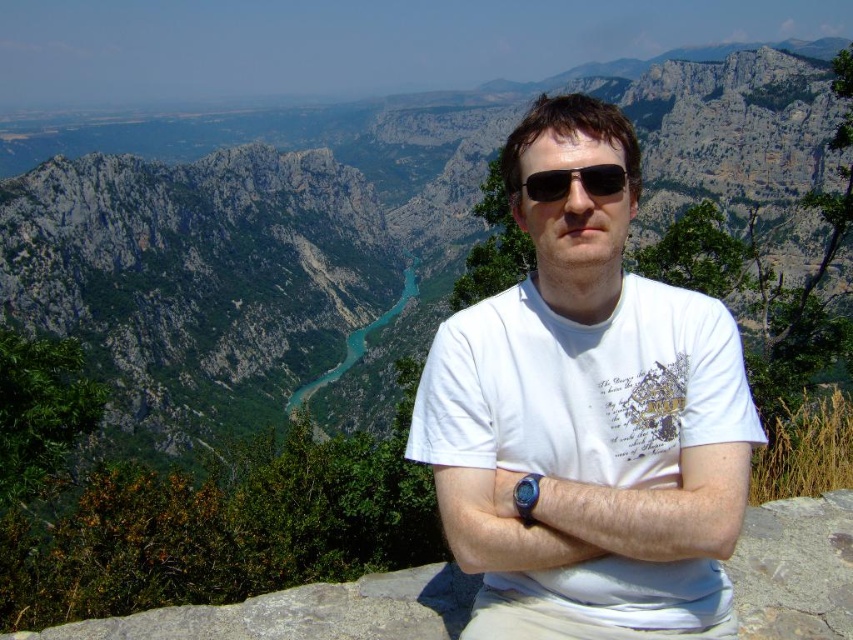
Question: Is gray rocky mountain at center thinner than black plastic sunglasses at center?

Choices:
 (A) no
 (B) yes

Answer: (A)

Question: From the image, what is the correct spatial relationship of gray rocky mountain at center in relation to black plastic sunglasses at center?

Choices:
 (A) below
 (B) above

Answer: (B)

Question: Which point is farther to the camera?

Choices:
 (A) black plastic sunglasses at center
 (B) white cotton t-shirt at center
 (C) gray rocky mountain at center

Answer: (C)

Question: Which object is farther from the camera taking this photo?

Choices:
 (A) black plastic sunglasses at center
 (B) white cotton t-shirt at center

Answer: (A)

Question: Among these objects, which one is farthest from the camera?

Choices:
 (A) gray rocky mountain at center
 (B) black plastic sunglasses at center

Answer: (A)

Question: Can you confirm if gray rocky mountain at center is thinner than black plastic sunglasses at center?

Choices:
 (A) no
 (B) yes

Answer: (A)